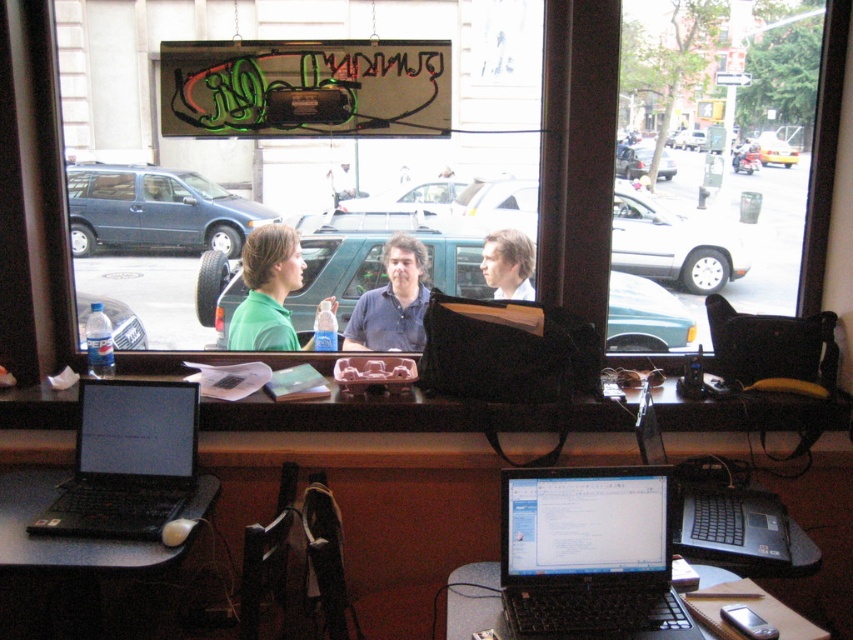
Question: In this image, where is black plastic laptop at lower right located relative to matte blue shirt at center?

Choices:
 (A) right
 (B) left

Answer: (A)

Question: Is black plastic laptop at lower right wider than matte blue shirt at center?

Choices:
 (A) yes
 (B) no

Answer: (A)

Question: Estimate the real-world distances between objects in this image. Which object is closer to the black glossy laptop at center?

Choices:
 (A) matte blue shirt at center
 (B) green matte shirt at center
 (C) black plastic table at center

Answer: (C)

Question: Observing the image, what is the correct spatial positioning of black plastic table at center in reference to black matte laptop at lower left?

Choices:
 (A) right
 (B) left

Answer: (A)

Question: Estimate the real-world distances between objects in this image. Which object is closer to the black plastic laptop at lower right?

Choices:
 (A) black matte laptop at lower left
 (B) black plastic table at center

Answer: (B)

Question: Which object is farther from the camera taking this photo?

Choices:
 (A) black matte laptop at lower left
 (B) black plastic laptop at lower right

Answer: (A)